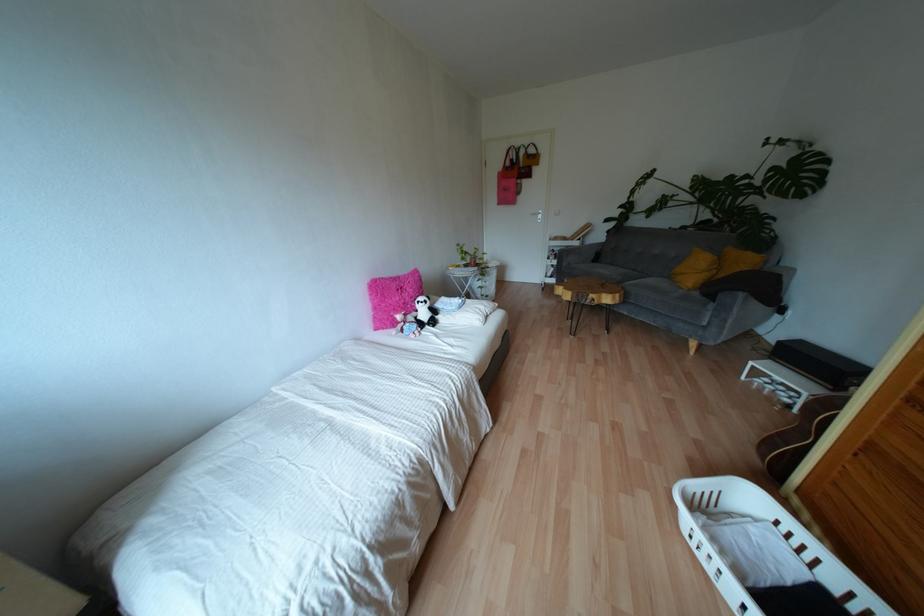
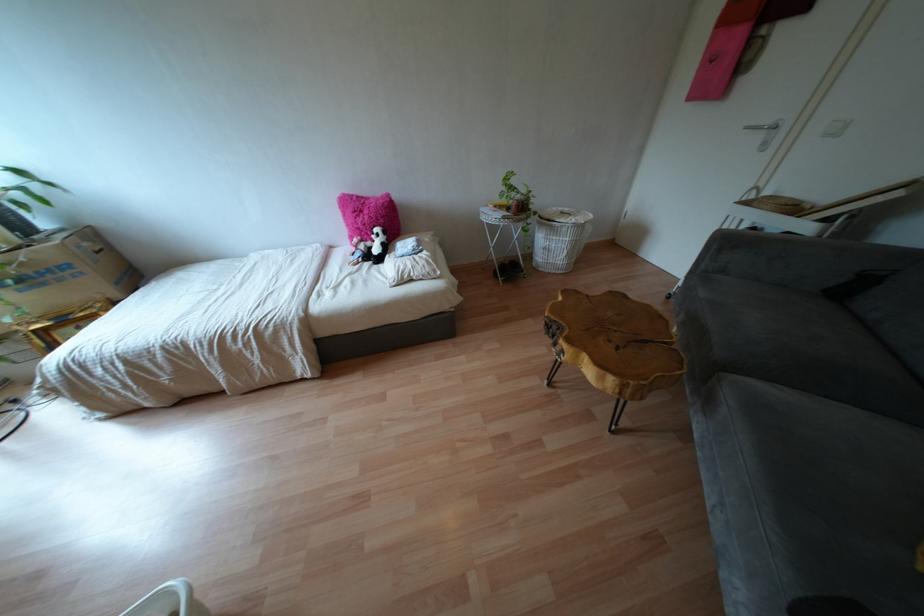
Where in the second image is the point corresponding to point 465,265 from the first image?

(506, 208)